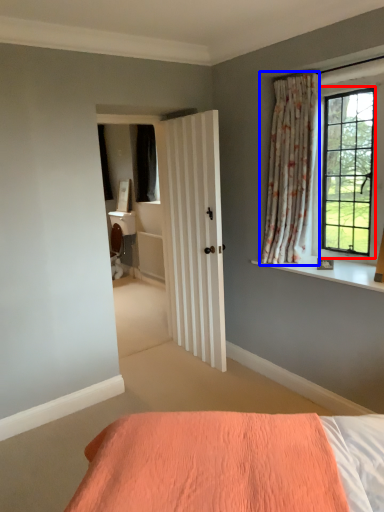
Question: Which object appears closest to the camera in this image, window (highlighted by a red box) or curtain (highlighted by a blue box)?

Choices:
 (A) window
 (B) curtain

Answer: (A)